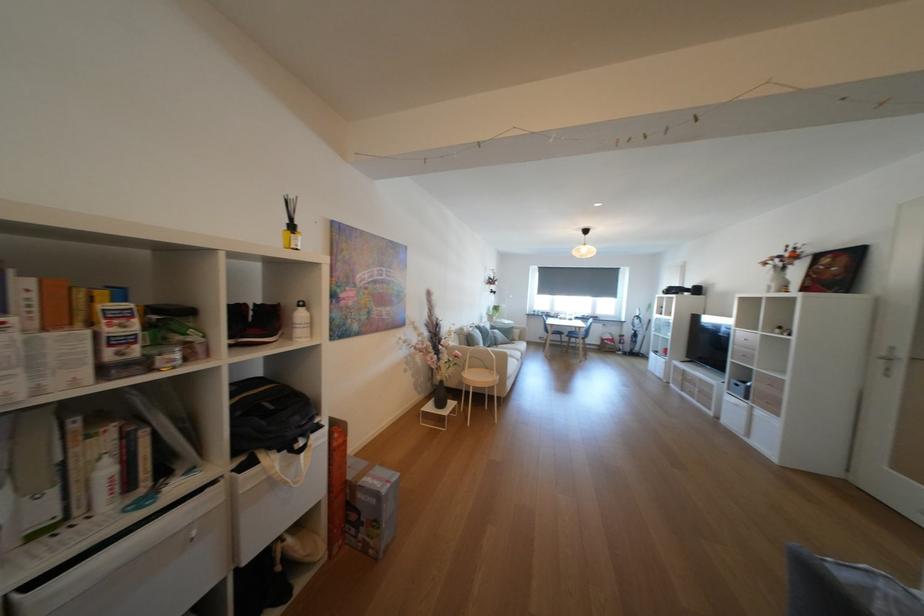
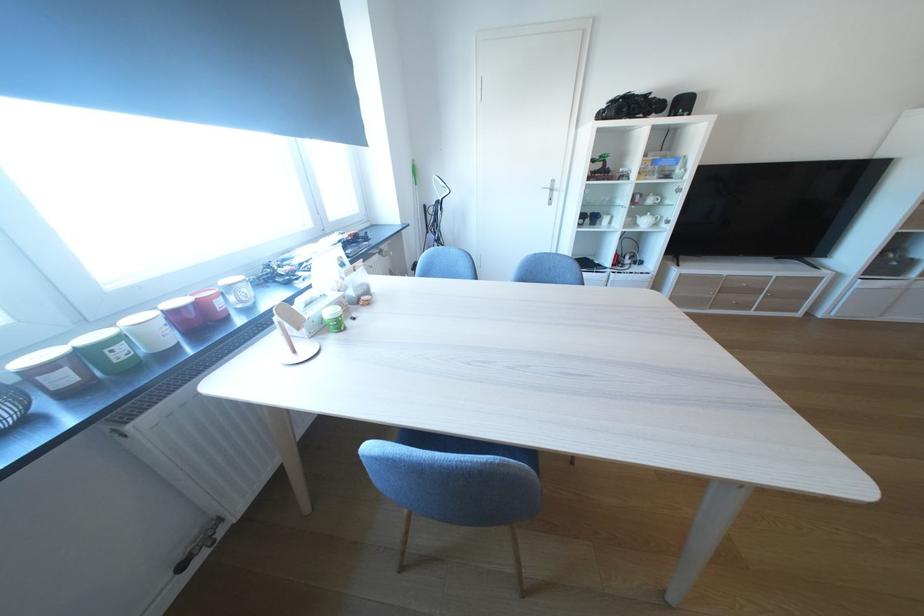
Where in the second image is the point corresponding to the point at 556,315 from the first image?

(75, 379)